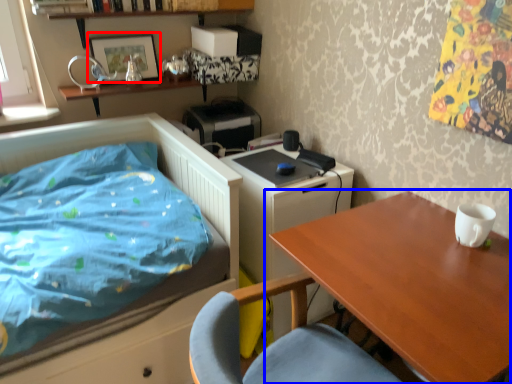
Question: Which object is closer to the camera taking this photo, picture frame (highlighted by a red box) or table (highlighted by a blue box)?

Choices:
 (A) picture frame
 (B) table

Answer: (B)